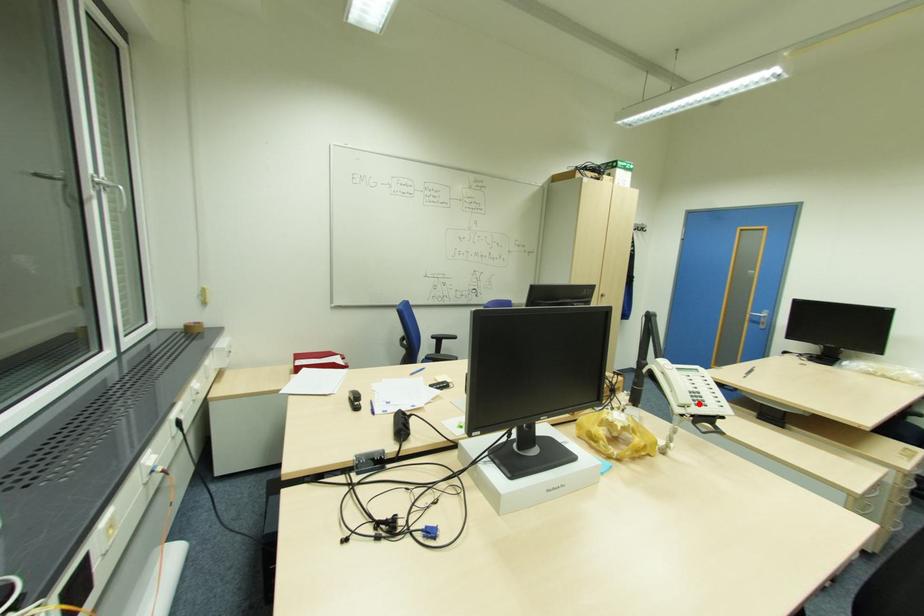
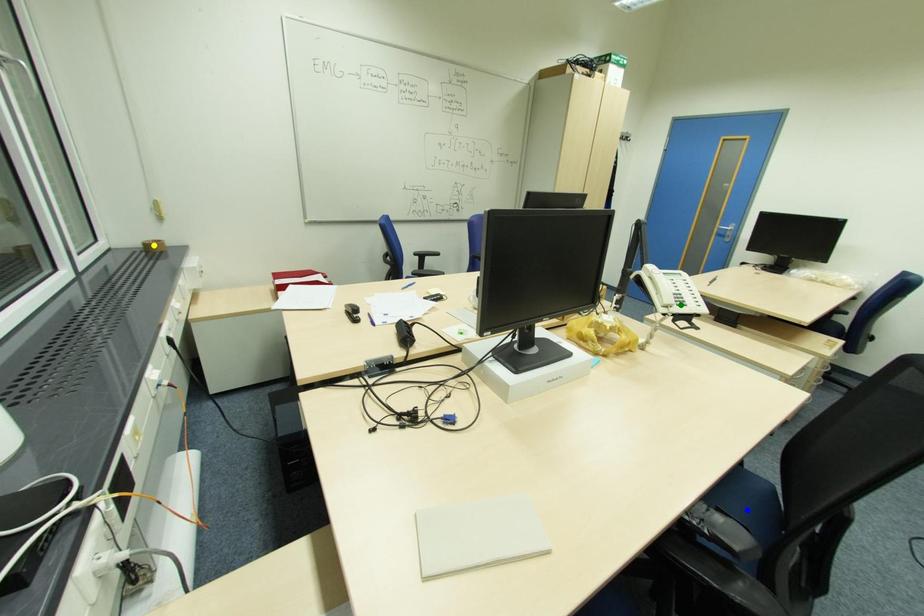
Question: I am providing you with two images of the same scene from different viewpoints. A red point is marked on the first image. You are given multiple points on the second image. In image 2, which mark is for the same physical point as the one in image 1?

Choices:
 (A) blue point
 (B) green point
 (C) yellow point

Answer: (B)